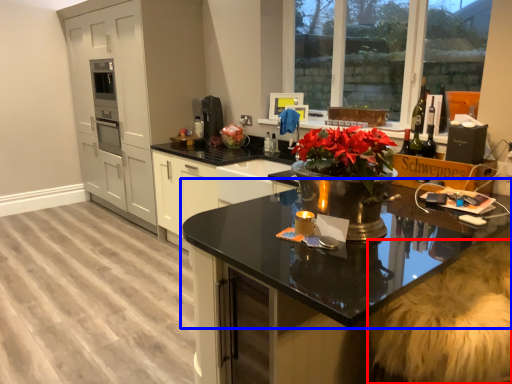
Question: Which object is further to the camera taking this photo, swivel chair (highlighted by a red box) or countertop (highlighted by a blue box)?

Choices:
 (A) swivel chair
 (B) countertop

Answer: (A)